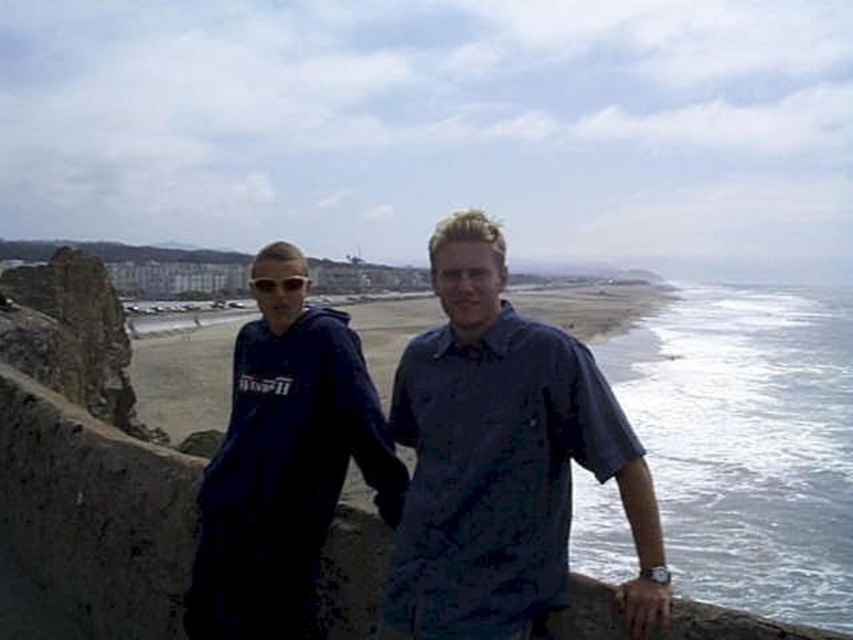
From the picture: You are standing at the coastal area shown in the image. There is a point marked at coordinates (502,460) which indicates the location of a blue fabric shirt at center. If you want to walk directly towards the blue fabric shirt at center, which direction should you head towards?

The point marked at coordinates (502,460) indicates the location of the blue fabric shirt at center. Since the coordinates are given in the image, you should head towards the center of the image to reach the blue fabric shirt at center.

You are a photographer trying to capture both the blue fabric shirt at center and the matte blue hoodie at left in a single frame. Since the camera has a limited focus range, which clothing item should you focus on first to ensure it appears sharp, considering their sizes?

→ The blue fabric shirt at center has a lesser width compared to the matte blue hoodie at left, so you should focus on the matte blue hoodie at left first because it is larger and might require more precise focus to ensure sharpness.

You are a photographer trying to capture a group photo of the blue fabric shirt at center and the matte blue hoodie at left. Since you want to ensure both are in the frame, which direction should you move the camera to include both individuals?

The blue fabric shirt at center is positioned on the right side of matte blue hoodie at left, so you should move the camera slightly to the left to include both individuals in the frame.